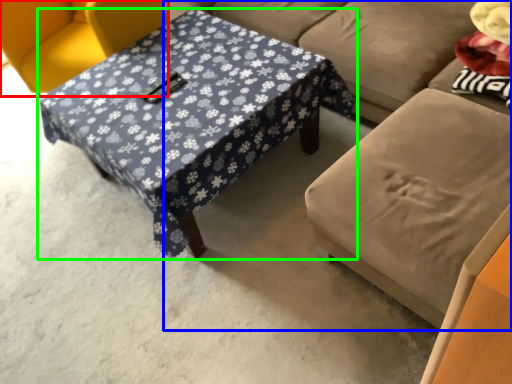
Question: Estimate the real-world distances between objects in this image. Which object is farther from chair (highlighted by a red box), studio couch (highlighted by a blue box) or table (highlighted by a green box)?

Choices:
 (A) studio couch
 (B) table

Answer: (A)